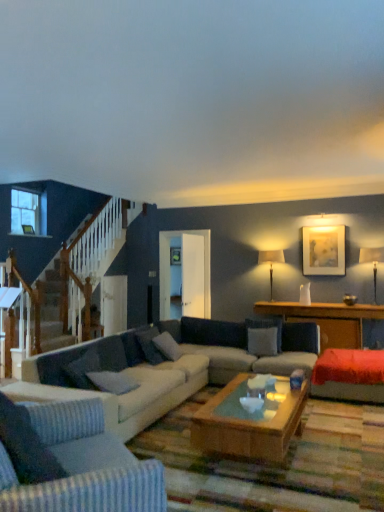
This screenshot has height=512, width=384. What do you see at coordinates (167, 346) in the screenshot? I see `gray fabric pillow at center, which appears as the 3th pillow when viewed from the left` at bounding box center [167, 346].

What do you see at coordinates (372, 262) in the screenshot? I see `matte white lampshade at upper right, placed as the second lamp when sorted from left to right` at bounding box center [372, 262].

This screenshot has width=384, height=512. I want to click on gray fabric pillow at center, the fourth pillow when ordered from front to back, so click(262, 341).

Describe the element at coordinates (187, 354) in the screenshot. This screenshot has width=384, height=512. I see `white fabric couch at center, which ranks as the first studio couch in back-to-front order` at that location.

Describe the element at coordinates (149, 345) in the screenshot. I see `gray fabric pillow at center, which is the 3th pillow in right-to-left order` at that location.

Identify the location of wooden coffee table at center. [x=327, y=319].

What is the approximate width of gray fabric pillow at center, which appears as the 1th pillow when viewed from the front?

14.83 inches.

You are a GUI agent. You are given a task and a screenshot of the screen. Output one action in this format:
    pyautogui.click(x=<x>, y=<y>)
    Task: Click on the gray fabric pillow at center, acting as the 3th pillow starting from the front
    This screenshot has height=512, width=384.
    Given the screenshot: What is the action you would take?
    pyautogui.click(x=167, y=346)

Does matte gold picture frame at upper right have a lesser width compared to gray fabric pillow at center, the third pillow viewed from the back?

Correct, the width of matte gold picture frame at upper right is less than that of gray fabric pillow at center, the third pillow viewed from the back.

Considering the positions of objects matte gold picture frame at upper right and gray fabric pillow at center, the 2th pillow in the left-to-right sequence, in the image provided, who is behind, matte gold picture frame at upper right or gray fabric pillow at center, the 2th pillow in the left-to-right sequence,?

matte gold picture frame at upper right is further from the camera.

From a real-world perspective, which is physically below, gray fabric pillow at center, the third pillow viewed from the back, or white fabric couch at center, the 2th studio couch in the front-to-back sequence?

white fabric couch at center, the 2th studio couch in the front-to-back sequence, from a real-world perspective.

From the image's perspective, would you say gray fabric pillow at center, the third pillow viewed from the back, is shown under white fabric couch at center, which ranks as the first studio couch in back-to-front order?

Incorrect, from the image's perspective, gray fabric pillow at center, the third pillow viewed from the back, is higher than white fabric couch at center, which ranks as the first studio couch in back-to-front order.

Which object is thinner, gray fabric pillow at center, the third pillow viewed from the back, or white fabric couch at center, the 2th studio couch in the front-to-back sequence?

Thinner between the two is gray fabric pillow at center, the third pillow viewed from the back.

Could you measure the distance between gray fabric pillow at center, which is counted as the second pillow, starting from the front, and white fabric couch at center, which ranks as the first studio couch in back-to-front order?

gray fabric pillow at center, which is counted as the second pillow, starting from the front, and white fabric couch at center, which ranks as the first studio couch in back-to-front order, are 24.17 inches apart.

Is matte white lampshade at center-right, which is counted as the first lamp, starting from the left, smaller than gray fabric pillow at center, the fourth pillow when ordered from front to back?

Incorrect, matte white lampshade at center-right, which is counted as the first lamp, starting from the left, is not smaller in size than gray fabric pillow at center, the fourth pillow when ordered from front to back.

Looking at this image, is matte white lampshade at center-right, arranged as the second lamp when viewed from the right, facing towards gray fabric pillow at center, the fourth pillow when ordered from front to back?

Yes, matte white lampshade at center-right, arranged as the second lamp when viewed from the right, is aimed at gray fabric pillow at center, the fourth pillow when ordered from front to back.

Identify the location of the 2nd lamp behind when counting from the gray fabric pillow at center, which is counted as the 4th pillow, starting from the left. This screenshot has width=384, height=512. (271, 263).

Is matte white lampshade at center-right, arranged as the second lamp when viewed from the right, to the left or to the right of gray fabric pillow at center, the fourth pillow when ordered from front to back, in the image?

Clearly, matte white lampshade at center-right, arranged as the second lamp when viewed from the right, is on the right of gray fabric pillow at center, the fourth pillow when ordered from front to back, in the image.

What's the angular difference between gray fabric pillow at center, which is counted as the second pillow, starting from the front, and velvet red couch at right's facing directions?

gray fabric pillow at center, which is counted as the second pillow, starting from the front, and velvet red couch at right are facing 91.3 degrees away from each other.

Which of these two, gray fabric pillow at center, the 2th pillow in the left-to-right sequence, or velvet red couch at right, is thinner?

With smaller width is gray fabric pillow at center, the 2th pillow in the left-to-right sequence.

Identify the location of the 3rd pillow located above the velvet red couch at right (from a real-world perspective). The width and height of the screenshot is (384, 512). (149, 345).

Who is more distant, gray fabric pillow at center, which is counted as the second pillow, starting from the front, or velvet red couch at right?

gray fabric pillow at center, which is counted as the second pillow, starting from the front, is further from the camera.

Does matte white lampshade at center-right, which is the second lamp from front to back, touch wooden coffee table at center?

matte white lampshade at center-right, which is the second lamp from front to back, and wooden coffee table at center are not in contact.

Do you think matte white lampshade at center-right, arranged as the second lamp when viewed from the right, is within wooden coffee table at center, or outside of it?

matte white lampshade at center-right, arranged as the second lamp when viewed from the right, exists outside the volume of wooden coffee table at center.

Can you tell me how much matte white lampshade at center-right, which is the first lamp from back to front, and wooden coffee table at center differ in facing direction?

There is a 1.98-degree angle between the facing directions of matte white lampshade at center-right, which is the first lamp from back to front, and wooden coffee table at center.

Considering the relative positions of matte white lampshade at center-right, which is the second lamp from front to back, and wooden coffee table at center in the image provided, is matte white lampshade at center-right, which is the second lamp from front to back, to the right of wooden coffee table at center from the viewer's perspective?

No, matte white lampshade at center-right, which is the second lamp from front to back, is not to the right of wooden coffee table at center.

From the image's perspective, is gray fabric pillow at center, acting as the 3th pillow starting from the front, positioned above or below matte white lampshade at upper right, which ranks as the 1th lamp in right-to-left order?

gray fabric pillow at center, acting as the 3th pillow starting from the front, is situated lower than matte white lampshade at upper right, which ranks as the 1th lamp in right-to-left order, in the image.

From a real-world perspective, is gray fabric pillow at center, the 2th pillow viewed from the right, positioned under matte white lampshade at upper right, which is the 1th lamp in front-to-back order, based on gravity?

Yes, from a real-world perspective, gray fabric pillow at center, the 2th pillow viewed from the right, is under matte white lampshade at upper right, which is the 1th lamp in front-to-back order.

Is gray fabric pillow at center, acting as the 3th pillow starting from the front, located outside matte white lampshade at upper right, which is the 1th lamp in front-to-back order?

Yes.

From the gray fabric pillow at center, the 2th pillow viewed from the right, count 2nd lamp to the right and point to it. Please provide its 2D coordinates.

[(372, 262)]

Is point (377, 261) behind point (152, 333)?

Yes, it is behind point (152, 333).

Who is smaller, matte white lampshade at upper right, placed as the second lamp when sorted from left to right, or gray fabric pillow at center, the third pillow viewed from the back?

With smaller size is gray fabric pillow at center, the third pillow viewed from the back.

Which is more to the left, matte white lampshade at upper right, acting as the second lamp starting from the back, or gray fabric pillow at center, the 2th pillow in the left-to-right sequence?

gray fabric pillow at center, the 2th pillow in the left-to-right sequence, is more to the left.

This screenshot has width=384, height=512. Find the location of `picture frame above the gray fabric pillow at center, the 2th pillow in the left-to-right sequence (from the image's perspective)`. picture frame above the gray fabric pillow at center, the 2th pillow in the left-to-right sequence (from the image's perspective) is located at coordinates (324, 250).

In order to click on studio couch that is the 1st object located in front of the gray fabric pillow at center, the 2th pillow in the left-to-right sequence in this screenshot , I will do `click(187, 354)`.

When comparing their distances from velvet red couch at right, does wooden coffee table at center or gray fabric pillow at center, which is counted as the 1th pillow, starting from the right, seem further?

gray fabric pillow at center, which is counted as the 1th pillow, starting from the right, is positioned further to the anchor velvet red couch at right.

Considering their positions, is gray fabric pillow at center, the 2th pillow in the left-to-right sequence, positioned further to gray fabric pillow at center, the second pillow in the back-to-front sequence, than light gray fabric couch at lower left, acting as the 1th studio couch starting from the front?

The object further to gray fabric pillow at center, the second pillow in the back-to-front sequence, is light gray fabric couch at lower left, acting as the 1th studio couch starting from the front.

Which object lies nearer to the anchor point gray fabric pillow at center, which is counted as the 4th pillow, starting from the left, clear glass window at upper left or matte gold picture frame at upper right?

matte gold picture frame at upper right is positioned closer to the anchor gray fabric pillow at center, which is counted as the 4th pillow, starting from the left.

Based on their spatial positions, is matte white lampshade at upper right, which is the 1th lamp in front-to-back order, or white fabric couch at center, the 2th studio couch in the front-to-back sequence, closer to matte gold picture frame at upper right?

matte white lampshade at upper right, which is the 1th lamp in front-to-back order, is closer to matte gold picture frame at upper right.

From the image, which object appears to be farther from matte white lampshade at upper right, placed as the second lamp when sorted from left to right, gray fabric pillow at center, which is counted as the 1th pillow, starting from the right, or gray fabric pillow at center, the 1th pillow positioned from the left?

gray fabric pillow at center, the 1th pillow positioned from the left, is further to matte white lampshade at upper right, placed as the second lamp when sorted from left to right.

When comparing their distances from wooden coffee table at center, does gray fabric pillow at center, the 4th pillow when ordered from right to left, or light gray fabric couch at lower left, the 2th studio couch when ordered from back to front, seem closer?

Among the two, gray fabric pillow at center, the 4th pillow when ordered from right to left, is located nearer to wooden coffee table at center.

Which object lies further to the anchor point matte white lampshade at upper right, which is the 1th lamp in front-to-back order, white fabric couch at center, which ranks as the first studio couch in back-to-front order, or gray fabric pillow at center, the third pillow viewed from the back?

The object further to matte white lampshade at upper right, which is the 1th lamp in front-to-back order, is gray fabric pillow at center, the third pillow viewed from the back.

Which object lies further to the anchor point clear glass window at upper left, matte gold picture frame at upper right or matte white lampshade at upper right, acting as the second lamp starting from the back?

matte white lampshade at upper right, acting as the second lamp starting from the back, is positioned further to the anchor clear glass window at upper left.

This screenshot has width=384, height=512. I want to click on pillow located between gray fabric pillow at center, the 2th pillow viewed from the right, and wooden coffee table at center in the left-right direction, so click(x=262, y=341).

What are the coordinates of `lamp between gray fabric pillow at center, the 2th pillow viewed from the right, and matte white lampshade at upper right, which ranks as the 1th lamp in right-to-left order` in the screenshot? It's located at (271, 263).

Locate an element on the screen. lamp located between gray fabric pillow at center, the 2th pillow in the left-to-right sequence, and matte white lampshade at upper right, acting as the second lamp starting from the back, in the left-right direction is located at coordinates (271, 263).

This screenshot has height=512, width=384. I want to click on studio couch positioned between light gray fabric couch at lower left, acting as the 1th studio couch starting from the front, and gray fabric pillow at center, which is counted as the 4th pillow, starting from the left, from near to far, so click(x=187, y=354).